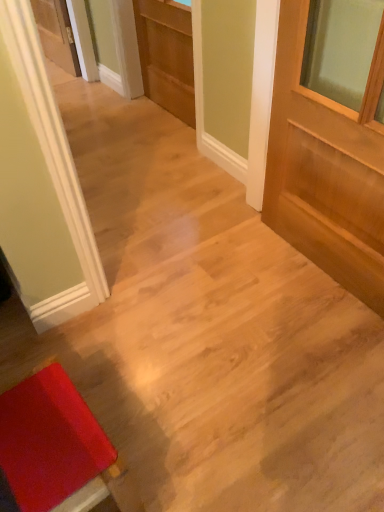
The height and width of the screenshot is (512, 384). What are the coordinates of `vacant space in light brown wood door at right, the first door when ordered from front to back (from a real-world perspective)` in the screenshot? It's located at (308, 264).